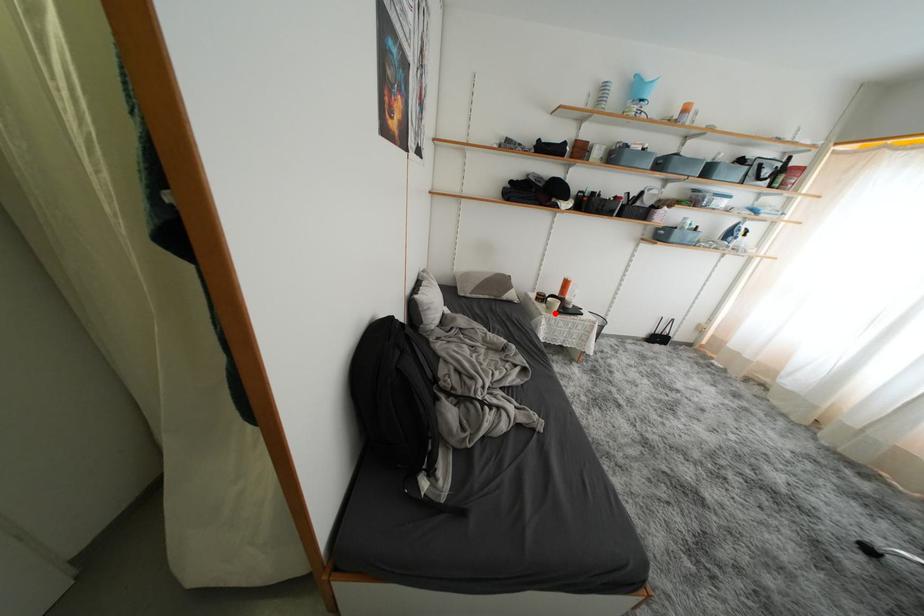
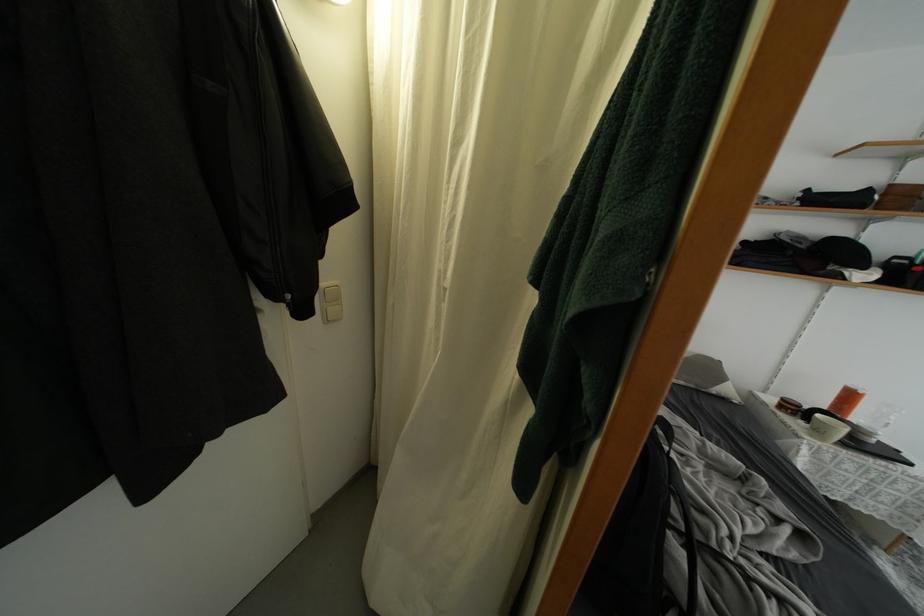
Question: I am providing you with two images of the same scene from different viewpoints. A red point is marked on the first image. Is the red point's position out of view in image 2?

Choices:
 (A) Yes
 (B) No

Answer: (B)